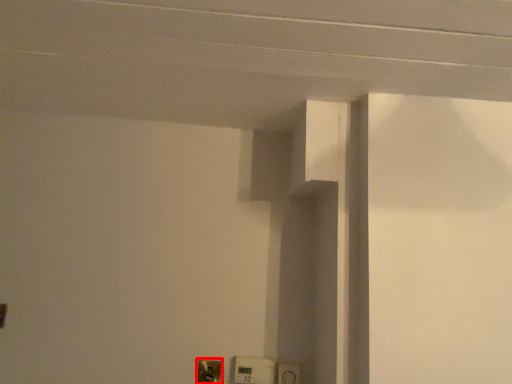
Question: From the image, what is the correct spatial relationship of light switch (annotated by the red box) in relation to light switch?

Choices:
 (A) right
 (B) left

Answer: (B)